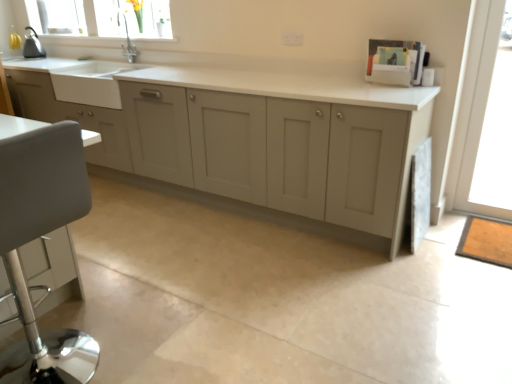
Question: Should I look upward or downward to see transparent glass door at right?

Choices:
 (A) up
 (B) down

Answer: (A)

Question: From a real-world perspective, does transparent glass door at right sit lower than matte gray cabinets at center?

Choices:
 (A) yes
 (B) no

Answer: (B)

Question: Is transparent glass door at right further to the viewer compared to matte gray cabinets at center?

Choices:
 (A) yes
 (B) no

Answer: (A)

Question: Is transparent glass door at right shorter than matte gray cabinets at center?

Choices:
 (A) no
 (B) yes

Answer: (A)

Question: Can you confirm if transparent glass door at right is wider than matte gray cabinets at center?

Choices:
 (A) yes
 (B) no

Answer: (B)

Question: Is transparent glass door at right smaller than matte gray cabinets at center?

Choices:
 (A) yes
 (B) no

Answer: (A)

Question: From the image's perspective, is transparent glass door at right located beneath matte gray cabinets at center?

Choices:
 (A) yes
 (B) no

Answer: (A)

Question: Considering the relative sizes of matte gray cabinets at center and white leather swivel chair at left in the image provided, is matte gray cabinets at center bigger than white leather swivel chair at left?

Choices:
 (A) no
 (B) yes

Answer: (B)

Question: Is matte gray cabinets at center not close to white leather swivel chair at left?

Choices:
 (A) no
 (B) yes

Answer: (B)

Question: Is matte gray cabinets at center oriented towards white leather swivel chair at left?

Choices:
 (A) yes
 (B) no

Answer: (A)

Question: Does matte gray cabinets at center contain white leather swivel chair at left?

Choices:
 (A) no
 (B) yes

Answer: (A)

Question: Is matte gray cabinets at center to the left of white leather swivel chair at left from the viewer's perspective?

Choices:
 (A) no
 (B) yes

Answer: (A)

Question: Is matte gray cabinets at center turned away from white leather swivel chair at left?

Choices:
 (A) no
 (B) yes

Answer: (A)

Question: Is clear glass window at upper left bigger than transparent glass door at right?

Choices:
 (A) yes
 (B) no

Answer: (B)